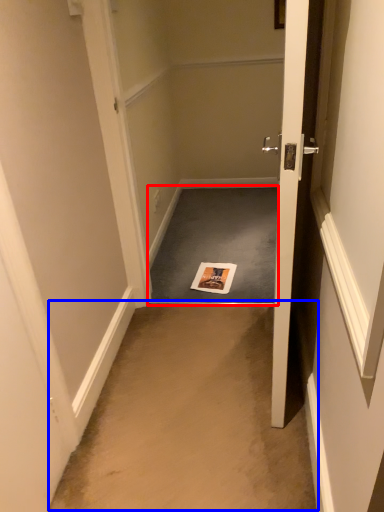
Question: Among these objects, which one is nearest to the camera, doormat (highlighted by a red box) or corridor (highlighted by a blue box)?

Choices:
 (A) doormat
 (B) corridor

Answer: (B)